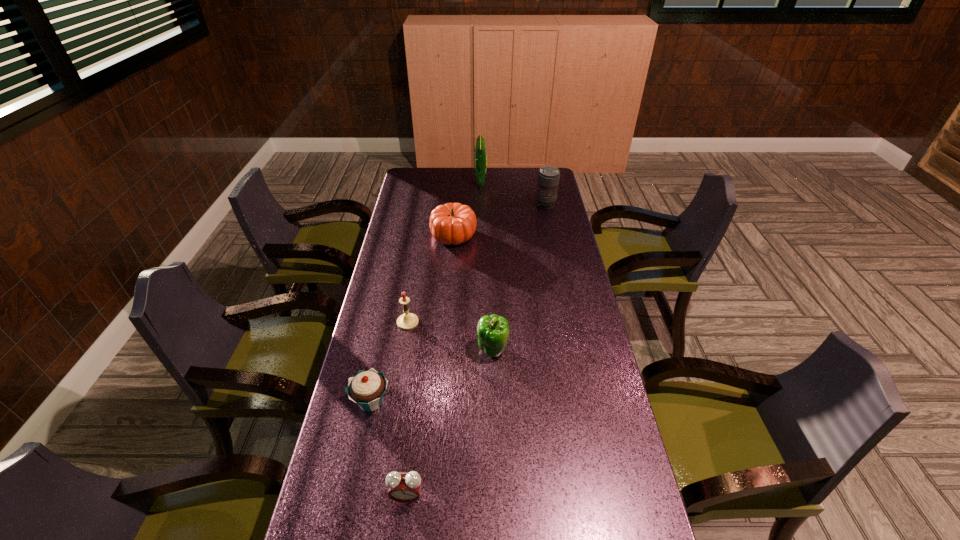
In order to click on free spot between the rightmost object and the third farthest object in this screenshot , I will do `click(499, 220)`.

Choose which object is the second nearest neighbor to the telephoto lens. Please provide its 2D coordinates. Your answer should be formatted as a tuple, i.e. [(x, y)], where the tuple contains the x and y coordinates of a point satisfying the conditions above.

[(453, 223)]

Point out which object is positioned as the third nearest to the third nearest object. Please provide its 2D coordinates. Your answer should be formatted as a tuple, i.e. [(x, y)], where the tuple contains the x and y coordinates of a point satisfying the conditions above.

[(404, 487)]